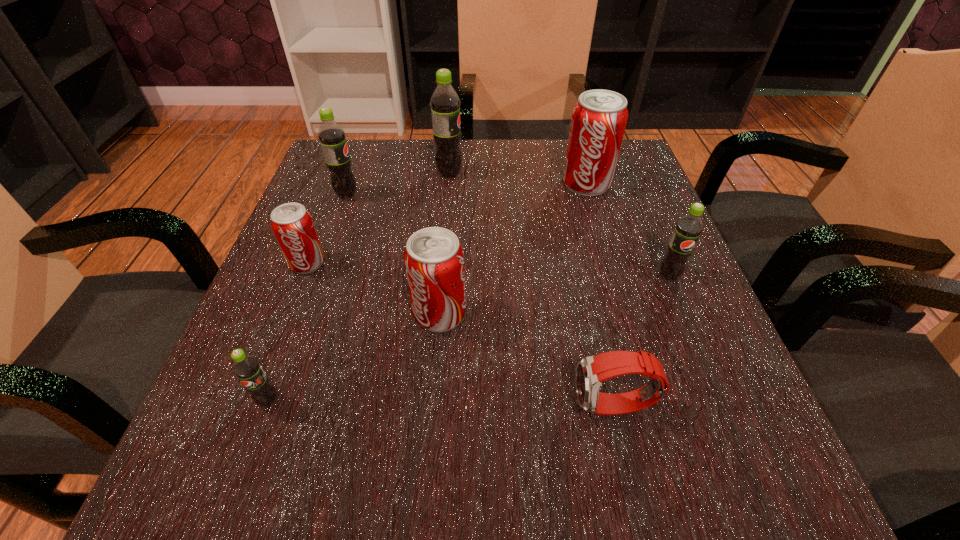
Locate which red soda can ranks in proximity to the third smallest green soda. Please provide its 2D coordinates. Your answer should be formatted as a tuple, i.e. [(x, y)], where the tuple contains the x and y coordinates of a point satisfying the conditions above.

[(292, 224)]

What are the coordinates of `free spot that satisfies the following two spatial constraints: 1. on the front label of the third nearest green soda; 2. on the left side of the second smallest red soda can` in the screenshot? It's located at (304, 314).

At what (x,y) coordinates should I click in order to perform the action: click on vacant area that satisfies the following two spatial constraints: 1. on the front label of the tallest soda; 2. on the front label of the nearest soda. Please return your answer as a coordinate pair (x, y). The image size is (960, 540). Looking at the image, I should click on (429, 400).

You are a GUI agent. You are given a task and a screenshot of the screen. Output one action in this format:
    pyautogui.click(x=<x>, y=<y>)
    Task: Click on the free location that satisfies the following two spatial constraints: 1. on the front label of the third nearest green soda; 2. on the right side of the sixth farthest soda
    
    Given the screenshot: What is the action you would take?
    pyautogui.click(x=304, y=314)

Locate an element on the screen. This screenshot has width=960, height=540. free spot that satisfies the following two spatial constraints: 1. on the back side of the second red soda can from left to right; 2. on the front label of the farthest green soda is located at coordinates (451, 174).

Identify the location of vacant space that satisfies the following two spatial constraints: 1. on the front label of the second biggest green soda; 2. on the front label of the smallest green soda. The width and height of the screenshot is (960, 540). (274, 400).

You are a GUI agent. You are given a task and a screenshot of the screen. Output one action in this format:
    pyautogui.click(x=<x>, y=<y>)
    Task: Click on the free space in the image that satisfies the following two spatial constraints: 1. on the front label of the rightmost object; 2. on the face of the watch
    
    Given the screenshot: What is the action you would take?
    pyautogui.click(x=724, y=407)